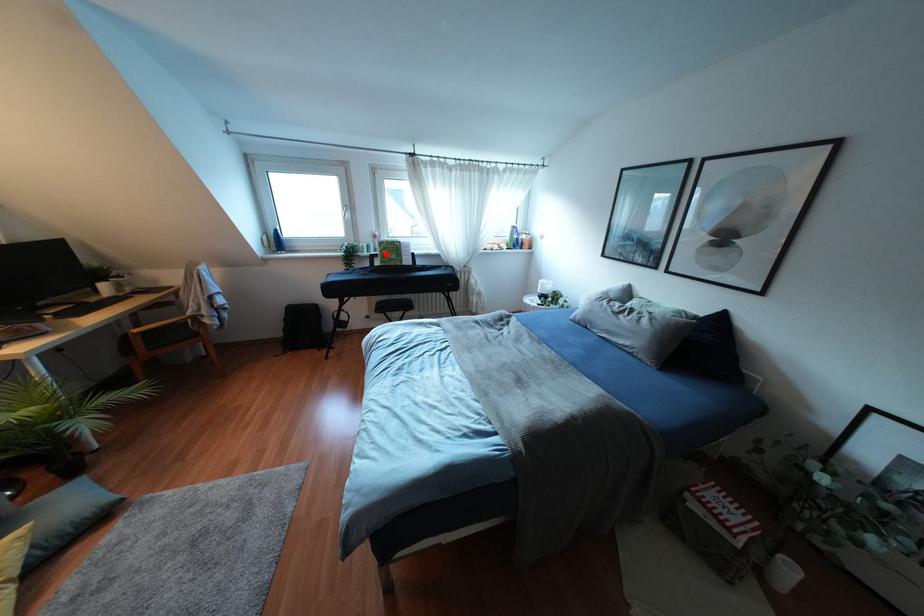
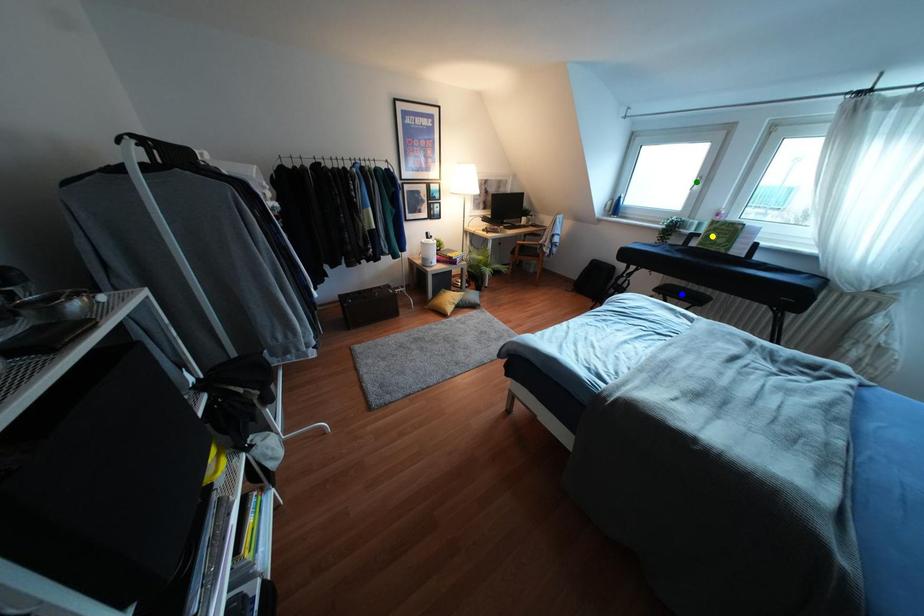
Question: I am providing you with two images of the same scene from different viewpoints. A red point is marked on the first image. You are given multiple points on the second image. Which point in image 2 is actually the same real-world point as the red point in image 1?

Choices:
 (A) blue point
 (B) green point
 (C) yellow point

Answer: (C)